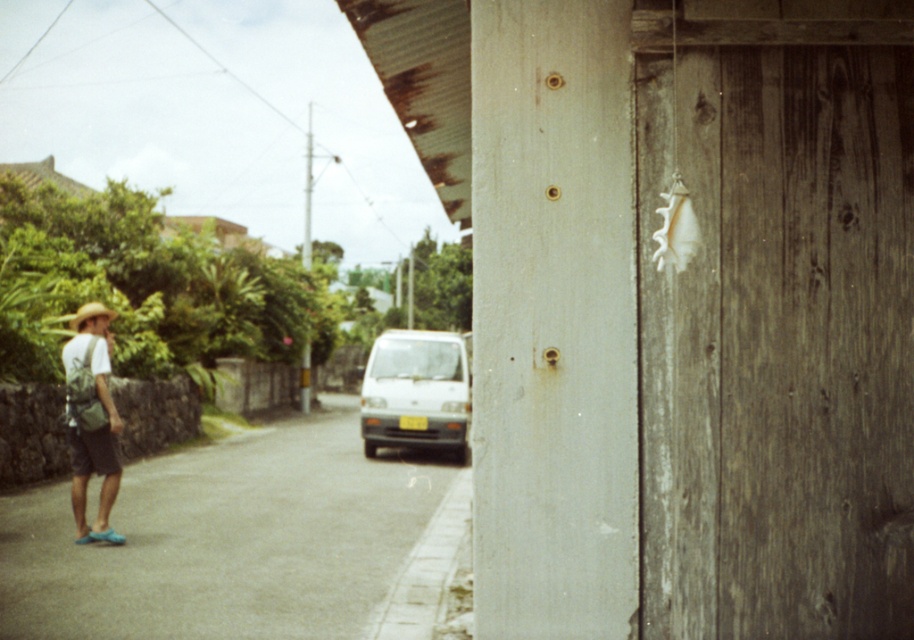
Question: Which point is closer to the camera?

Choices:
 (A) (90, 433)
 (B) (373, 342)

Answer: (A)

Question: Can you confirm if gray asphalt pavement at lower left is smaller than matte green backpack at left?

Choices:
 (A) yes
 (B) no

Answer: (B)

Question: Among these points, which one is nearest to the camera?

Choices:
 (A) (91, 328)
 (B) (250, 566)
 (C) (418, 442)

Answer: (B)

Question: Does white matte van at center appear on the left side of matte green backpack at left?

Choices:
 (A) yes
 (B) no

Answer: (B)

Question: Is gray asphalt pavement at lower left bigger than white matte van at center?

Choices:
 (A) yes
 (B) no

Answer: (B)

Question: Based on their relative distances, which object is nearer to the matte green backpack at left?

Choices:
 (A) white matte van at center
 (B) gray asphalt pavement at lower left

Answer: (B)